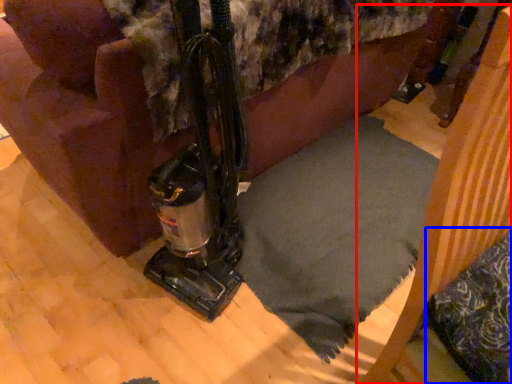
Question: Which point is further to the camera, furniture (highlighted by a red box) or pillow (highlighted by a blue box)?

Choices:
 (A) furniture
 (B) pillow

Answer: (B)